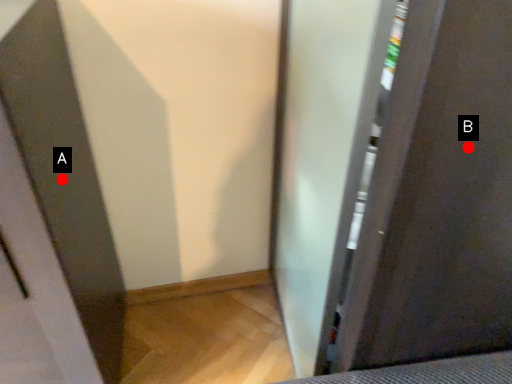
Question: Two points are circled on the image, labeled by A and B beside each circle. Among these points, which one is nearest to the camera?

Choices:
 (A) A is closer
 (B) B is closer

Answer: (B)